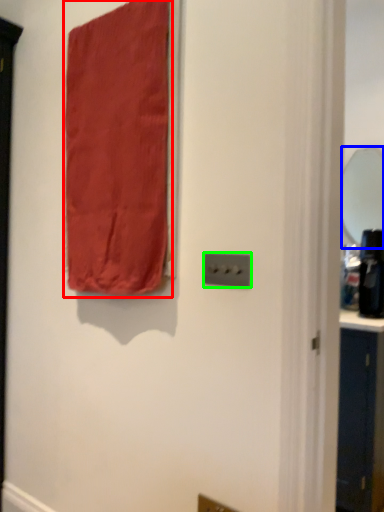
Question: Which object is the farthest from curtain (highlighted by a red box)? Choose among these: mirror (highlighted by a blue box) or light switch (highlighted by a green box).

Choices:
 (A) mirror
 (B) light switch

Answer: (A)